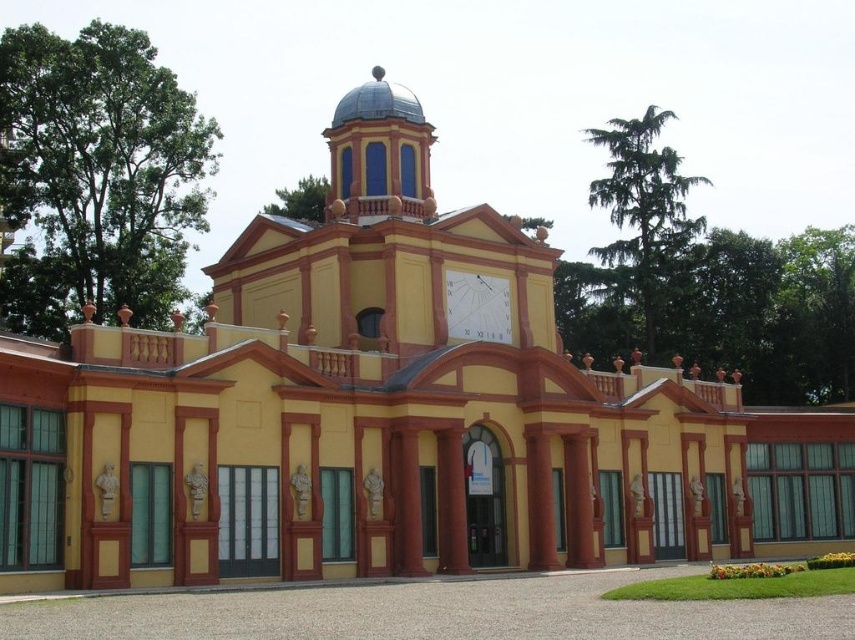
Question: From the image, what is the correct spatial relationship of blue glass dome at center in relation to white glossy clock at center?

Choices:
 (A) above
 (B) below

Answer: (A)

Question: Which point is closer to the camera taking this photo?

Choices:
 (A) (338, 145)
 (B) (446, 298)

Answer: (B)

Question: Is blue glass dome at center wider than white glossy clock at center?

Choices:
 (A) no
 (B) yes

Answer: (B)

Question: Which object appears farthest from the camera in this image?

Choices:
 (A) white glossy clock at center
 (B) blue glass dome at center

Answer: (A)

Question: Which point appears closest to the camera in this image?

Choices:
 (A) (506, 333)
 (B) (423, 211)

Answer: (A)

Question: Can you confirm if blue glass dome at center is positioned below white glossy clock at center?

Choices:
 (A) no
 (B) yes

Answer: (A)